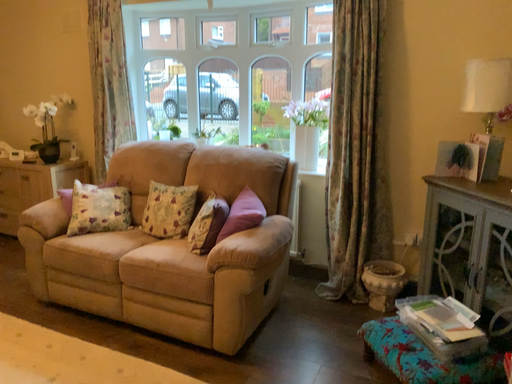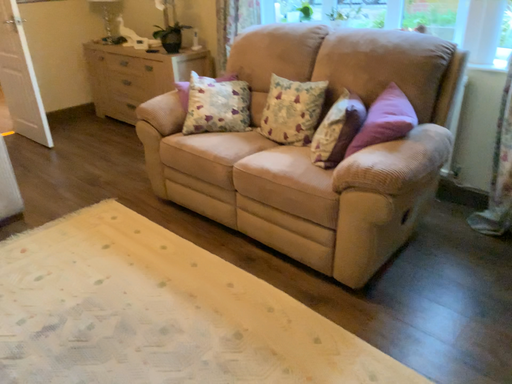
Question: Which way did the camera rotate in the video?

Choices:
 (A) rotated upward
 (B) rotated downward

Answer: (B)